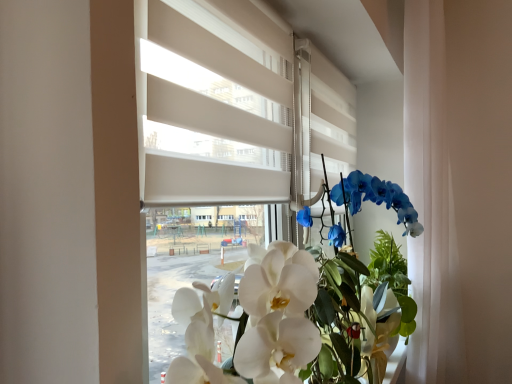
Question: Considering the relative sizes of white glossy orchid at center and white matte blinds at center in the image provided, is white glossy orchid at center shorter than white matte blinds at center?

Choices:
 (A) yes
 (B) no

Answer: (A)

Question: Is white glossy orchid at center to the right of white matte blinds at center from the viewer's perspective?

Choices:
 (A) yes
 (B) no

Answer: (A)

Question: From a real-world perspective, does white glossy orchid at center sit lower than white matte blinds at center?

Choices:
 (A) yes
 (B) no

Answer: (A)

Question: From the image's perspective, would you say white glossy orchid at center is shown under white matte blinds at center?

Choices:
 (A) no
 (B) yes

Answer: (B)

Question: From the image's perspective, would you say white glossy orchid at center is positioned over white matte blinds at center?

Choices:
 (A) no
 (B) yes

Answer: (A)

Question: Looking at their shapes, would you say white matte blinds at center is wider or thinner than white sheer curtain at right?

Choices:
 (A) thin
 (B) wide

Answer: (A)

Question: From the image's perspective, relative to white sheer curtain at right, is white matte blinds at center above or below?

Choices:
 (A) below
 (B) above

Answer: (B)

Question: From their relative heights in the image, would you say white matte blinds at center is taller or shorter than white sheer curtain at right?

Choices:
 (A) short
 (B) tall

Answer: (A)

Question: Is point (148, 185) closer or farther from the camera than point (442, 39)?

Choices:
 (A) farther
 (B) closer

Answer: (B)

Question: Is white glossy orchid at center wider or thinner than white sheer curtain at right?

Choices:
 (A) wide
 (B) thin

Answer: (A)

Question: Is white glossy orchid at center taller or shorter than white sheer curtain at right?

Choices:
 (A) short
 (B) tall

Answer: (A)

Question: Looking at the image, does white glossy orchid at center seem bigger or smaller compared to white sheer curtain at right?

Choices:
 (A) big
 (B) small

Answer: (B)

Question: From a real-world perspective, is white glossy orchid at center positioned above or below white sheer curtain at right?

Choices:
 (A) below
 (B) above

Answer: (A)

Question: From the image's perspective, is white sheer curtain at right located above or below white matte blinds at center?

Choices:
 (A) below
 (B) above

Answer: (A)

Question: From a real-world perspective, is white sheer curtain at right physically located above or below white matte blinds at center?

Choices:
 (A) above
 (B) below

Answer: (B)